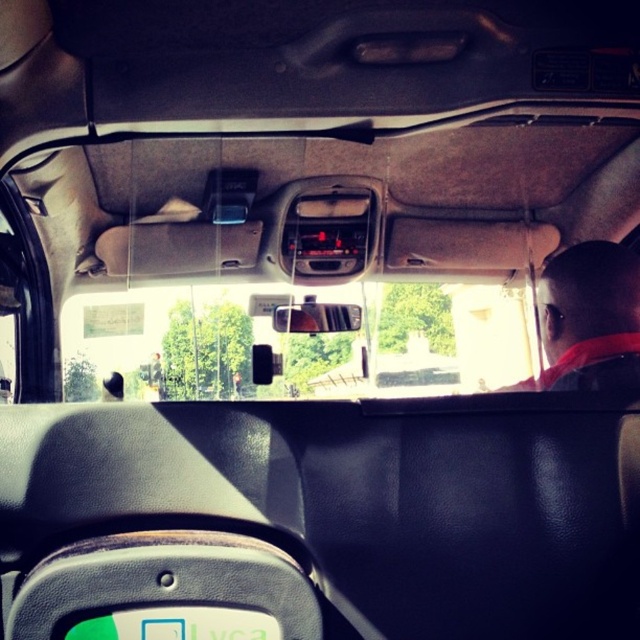
Question: Which is farther from the dark gray fabric headrest at right?

Choices:
 (A) green matte license plate at lower center
 (B) clear plastic view mirror at center

Answer: (B)

Question: Which object is closer to the camera taking this photo?

Choices:
 (A) dark gray fabric headrest at right
 (B) clear plastic view mirror at center

Answer: (A)

Question: Can you confirm if dark gray fabric headrest at right is thinner than clear plastic view mirror at center?

Choices:
 (A) no
 (B) yes

Answer: (B)

Question: Does dark gray fabric headrest at right have a smaller size compared to clear plastic view mirror at center?

Choices:
 (A) no
 (B) yes

Answer: (B)

Question: Based on their relative distances, which object is farther from the green matte license plate at lower center?

Choices:
 (A) clear plastic view mirror at center
 (B) dark gray fabric headrest at right

Answer: (A)

Question: Where is dark gray fabric headrest at right located in relation to clear plastic view mirror at center in the image?

Choices:
 (A) above
 (B) below

Answer: (A)